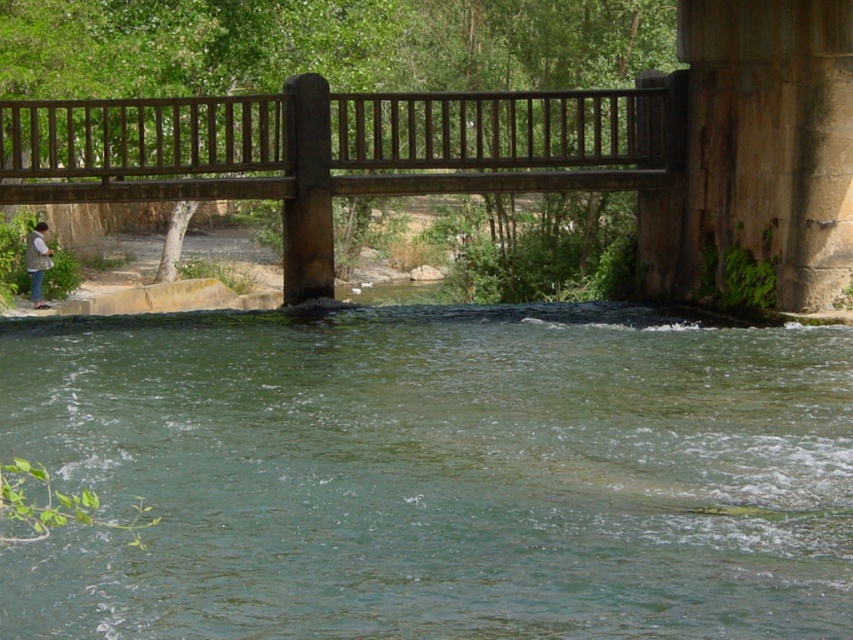
Question: In this image, where is clear water at center located relative to denim jacket at lower left?

Choices:
 (A) right
 (B) left

Answer: (A)

Question: From the image, what is the correct spatial relationship of clear water at center in relation to brown wooden bridge at upper center?

Choices:
 (A) below
 (B) above

Answer: (A)

Question: Does brown wooden bridge at upper center appear on the right side of denim jacket at lower left?

Choices:
 (A) yes
 (B) no

Answer: (A)

Question: Among these points, which one is farthest from the camera?

Choices:
 (A) (33, 246)
 (B) (315, 76)

Answer: (A)

Question: Which of the following is the closest to the observer?

Choices:
 (A) denim jacket at lower left
 (B) clear water at center
 (C) brown wooden bridge at upper center

Answer: (B)

Question: Among these points, which one is nearest to the camera?

Choices:
 (A) (538, 148)
 (B) (26, 253)

Answer: (A)